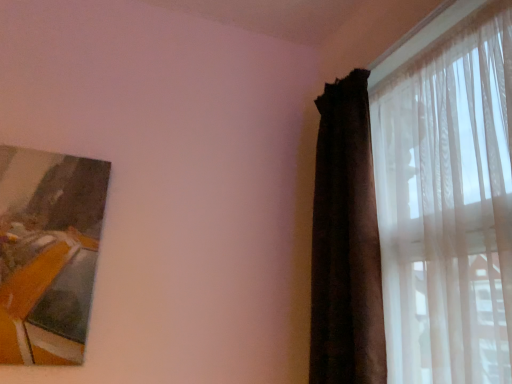
Question: From a real-world perspective, is translucent sheer curtain at right, the 2th curtain when ordered from left to right, physically located above or below wooden frame at upper left?

Choices:
 (A) above
 (B) below

Answer: (A)

Question: Considering the positions of translucent sheer curtain at right, placed as the first curtain when sorted from right to left, and wooden frame at upper left in the image, is translucent sheer curtain at right, placed as the first curtain when sorted from right to left, taller or shorter than wooden frame at upper left?

Choices:
 (A) short
 (B) tall

Answer: (B)

Question: Which object is the farthest from the dark velvet curtain at right, placed as the 1th curtain when sorted from left to right?

Choices:
 (A) wooden frame at upper left
 (B) translucent sheer curtain at right, placed as the first curtain when sorted from right to left

Answer: (A)

Question: Estimate the real-world distances between objects in this image. Which object is closer to the translucent sheer curtain at right, the 2th curtain when ordered from left to right?

Choices:
 (A) wooden frame at upper left
 (B) dark velvet curtain at right, placed as the 1th curtain when sorted from left to right

Answer: (B)